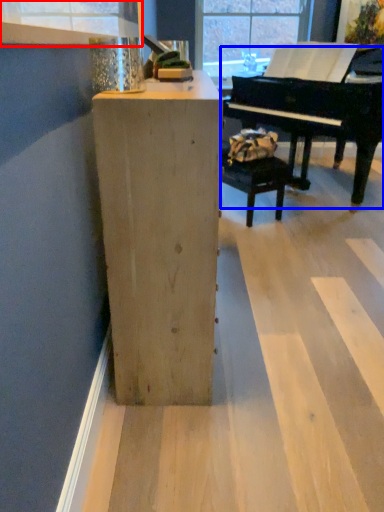
Question: Which of the following is the farthest to the observer, window frame (highlighted by a red box) or piano (highlighted by a blue box)?

Choices:
 (A) window frame
 (B) piano

Answer: (B)